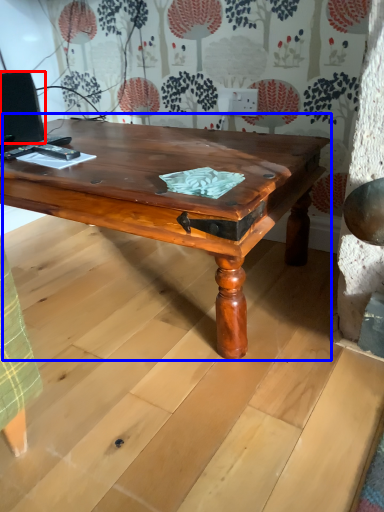
Question: Which of the following is the farthest to the observer, computer monitor (highlighted by a red box) or coffee table (highlighted by a blue box)?

Choices:
 (A) computer monitor
 (B) coffee table

Answer: (A)